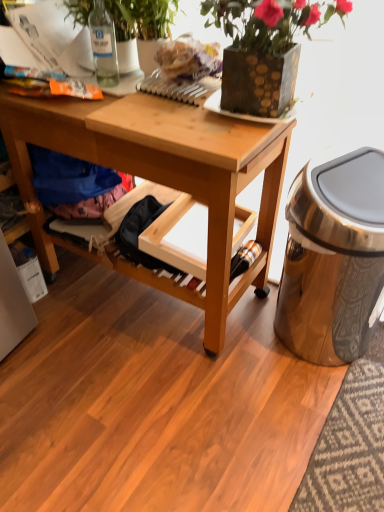
Identify the location of free spot below polished metallic trash can at right (from a real-world perspective). Image resolution: width=384 pixels, height=512 pixels. (309, 350).